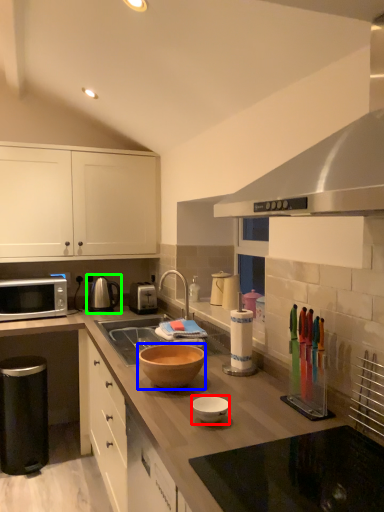
Question: Which object is positioned closest to bowl (highlighted by a red box)? Select from bowl (highlighted by a blue box) and tea pot (highlighted by a green box).

Choices:
 (A) bowl
 (B) tea pot

Answer: (A)